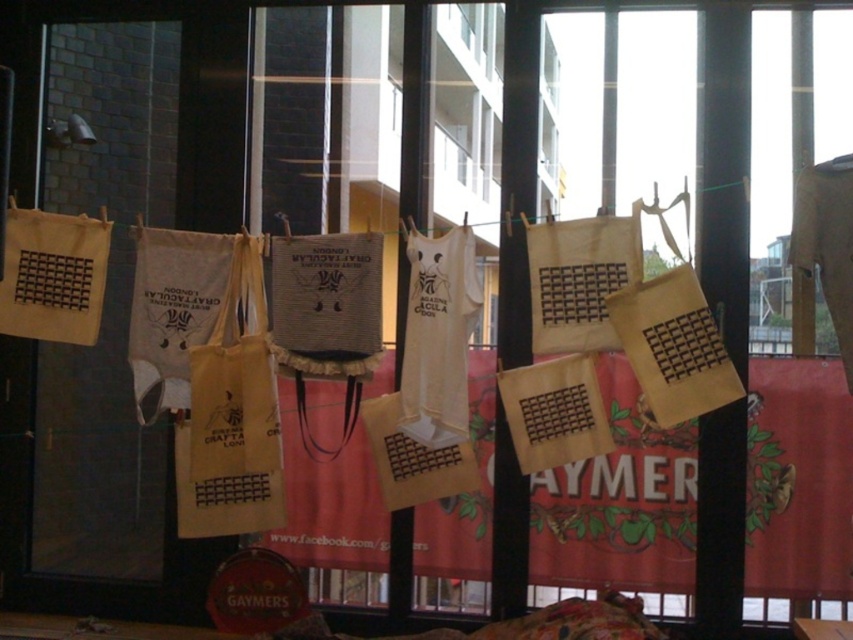
Question: Can you confirm if matte brown tote at center is bigger than white cotton t-shirt at center?

Choices:
 (A) no
 (B) yes

Answer: (B)

Question: Among these points, which one is nearest to the camera?

Choices:
 (A) (206, 449)
 (B) (403, 413)

Answer: (B)

Question: Which point is farther to the camera?

Choices:
 (A) (456, 262)
 (B) (241, 284)

Answer: (B)

Question: Does matte brown tote at center have a lesser width compared to white cotton t-shirt at center?

Choices:
 (A) yes
 (B) no

Answer: (B)

Question: Can you confirm if matte brown tote at center is wider than white cotton t-shirt at center?

Choices:
 (A) no
 (B) yes

Answer: (B)

Question: Which object appears farthest from the camera in this image?

Choices:
 (A) matte brown tote at center
 (B) white cotton t-shirt at center

Answer: (A)